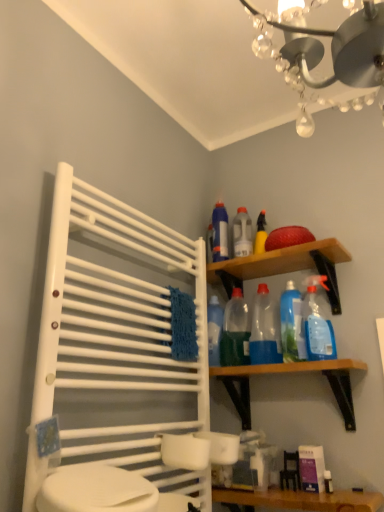
The height and width of the screenshot is (512, 384). What are the coordinates of `free point above wooden shelf at upper right, which is the 2th shelf from bottom to top (from a real-world perspective)` in the screenshot? It's located at click(269, 257).